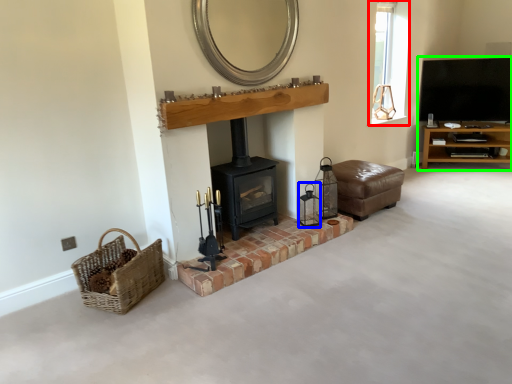
Question: Which object is the closest to the window (highlighted by a red box)? Choose among these: candle holder (highlighted by a blue box) or entertainment center (highlighted by a green box).

Choices:
 (A) candle holder
 (B) entertainment center

Answer: (B)